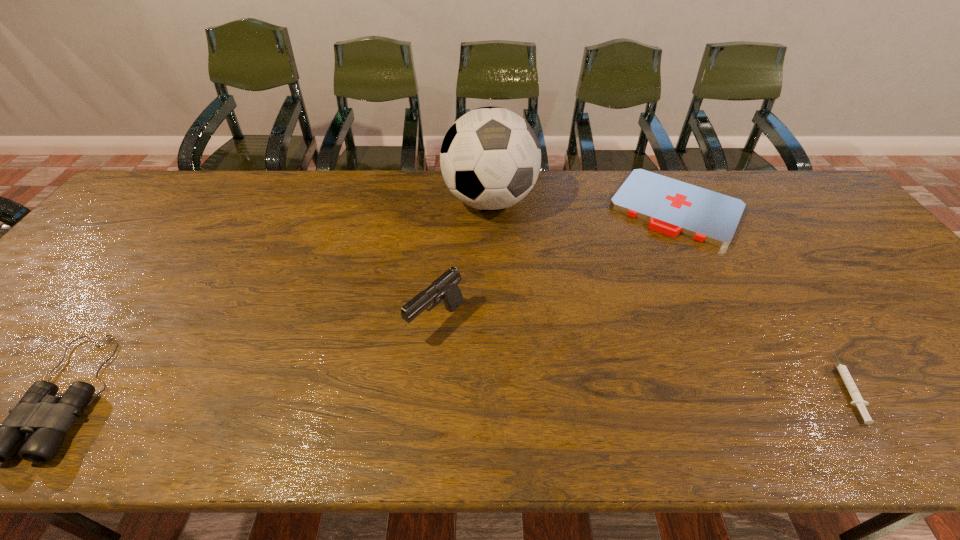
Locate an element on the screen. free space on the desktop that is between the third shortest object and the syringe and is positioned aim along the barrel of the pistol is located at coordinates (357, 390).

I want to click on vacant space on the desktop that is between the third shortest object and the syringe and is positioned on handle side the first-aid kit, so click(571, 388).

Locate an element on the screen. free spot on the desktop that is between the third tallest object and the syringe and is positioned on the main logo of the tallest object is located at coordinates (522, 389).